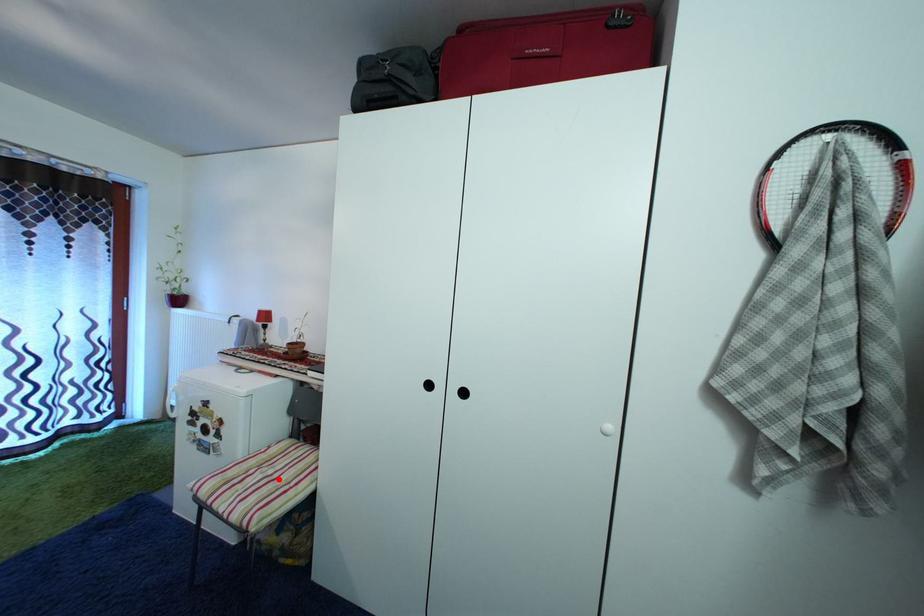
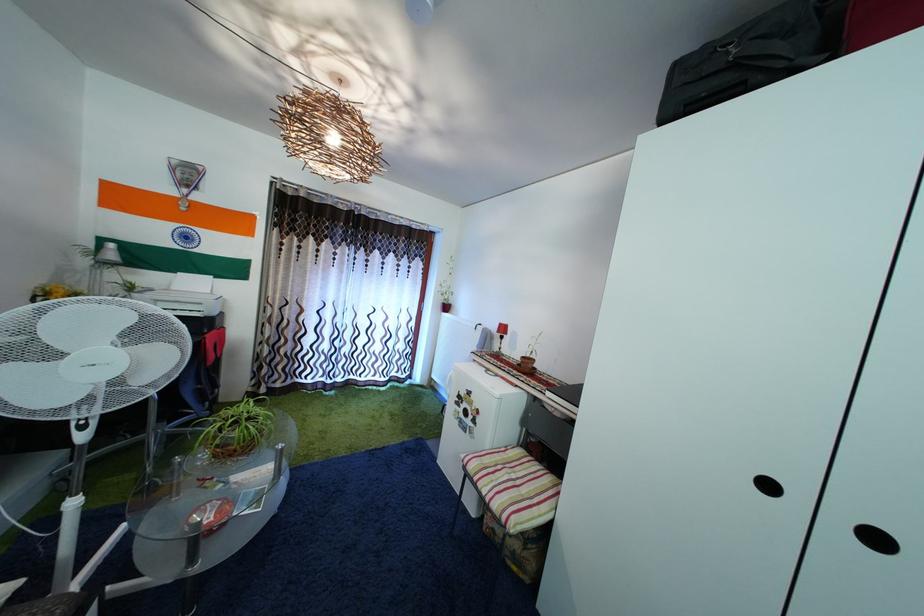
Locate, in the second image, the point that corresponds to the highlighted location in the first image.

(521, 484)